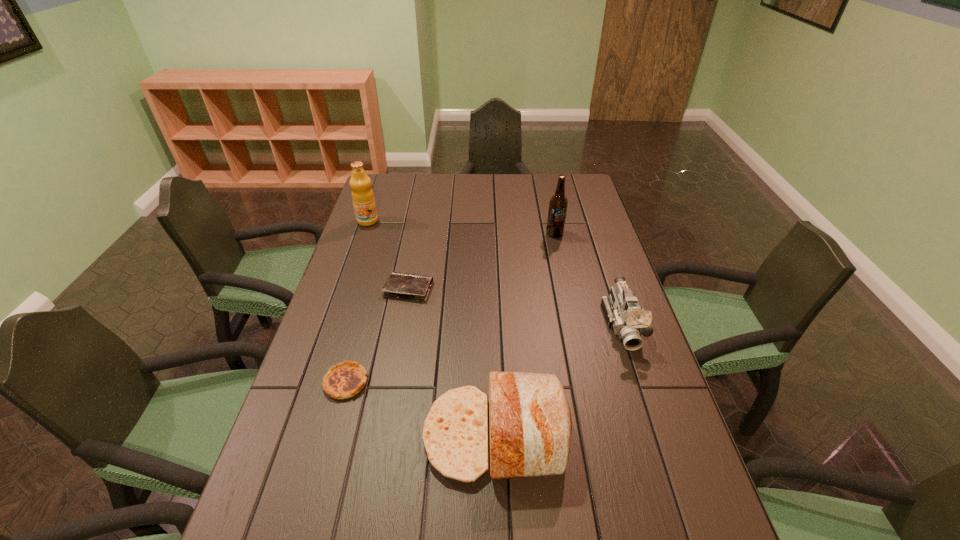
This screenshot has height=540, width=960. Find the location of `free space between the fifth nearest object and the farthest object`. free space between the fifth nearest object and the farthest object is located at coordinates [461, 227].

Identify the location of empty space between the fruit juice and the second object from right to left. The width and height of the screenshot is (960, 540). (461, 227).

You are a GUI agent. You are given a task and a screenshot of the screen. Output one action in this format:
    pyautogui.click(x=<x>, y=<y>)
    Task: Click on the empty space between the camcorder and the quiche
    The height and width of the screenshot is (540, 960).
    Given the screenshot: What is the action you would take?
    pyautogui.click(x=485, y=354)

Identify the location of unoccupied area between the quiche and the rightmost object. (485, 354).

Locate which object ranks second in proximity to the quiche. Please provide its 2D coordinates. Your answer should be formatted as a tuple, i.e. [(x, y)], where the tuple contains the x and y coordinates of a point satisfying the conditions above.

[(413, 287)]

Find the location of `the third closest object relative to the fifth object from left to right`. the third closest object relative to the fifth object from left to right is located at coordinates (363, 198).

Where is `free spot that satisfies the following two spatial constraints: 1. on the front label of the farthest object; 2. on the left side of the quiche`? This screenshot has width=960, height=540. free spot that satisfies the following two spatial constraints: 1. on the front label of the farthest object; 2. on the left side of the quiche is located at coordinates (313, 382).

Image resolution: width=960 pixels, height=540 pixels. Find the location of `vacant position in the image that satisfies the following two spatial constraints: 1. on the front label of the diary; 2. on the left side of the fruit juice`. vacant position in the image that satisfies the following two spatial constraints: 1. on the front label of the diary; 2. on the left side of the fruit juice is located at coordinates (345, 289).

Where is `free point that satisfies the following two spatial constraints: 1. on the label of the fifth object from left to right; 2. at the sliced end of the bread`? free point that satisfies the following two spatial constraints: 1. on the label of the fifth object from left to right; 2. at the sliced end of the bread is located at coordinates (598, 435).

Locate an element on the screen. The image size is (960, 540). free space that satisfies the following two spatial constraints: 1. on the front label of the quiche; 2. on the left side of the fruit juice is located at coordinates click(x=313, y=382).